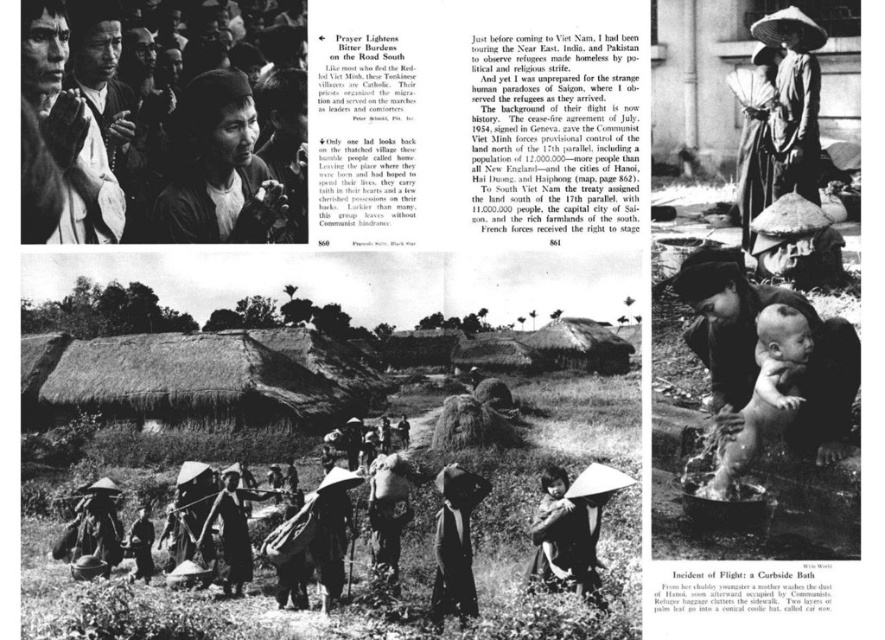
Who is higher up, dark skin baby at lower right or matte white hat at center?

dark skin baby at lower right

Is point (748, 451) positioned in front of point (548, 586)?

Yes, it is in front of point (548, 586).

Identify the location of dark skin baby at lower right. (766, 394).